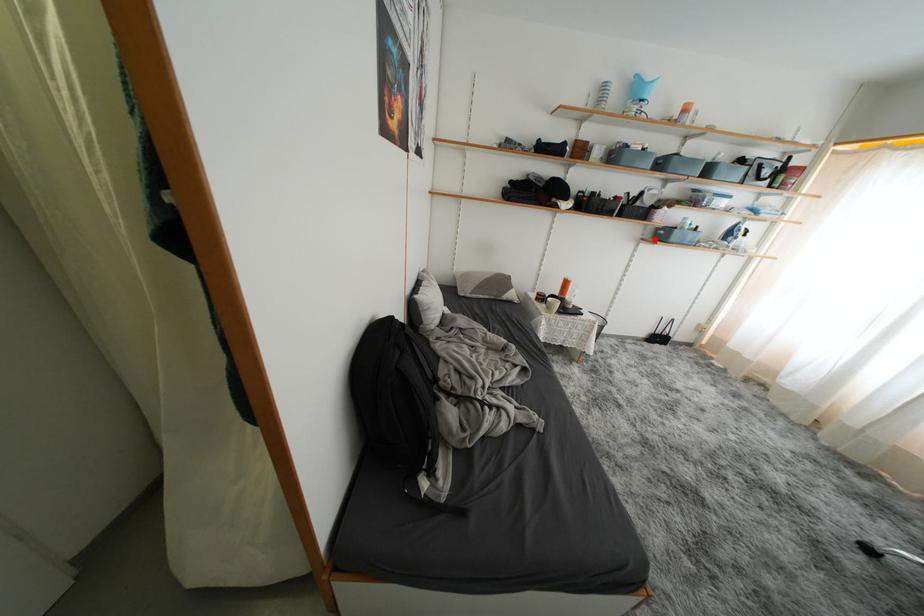
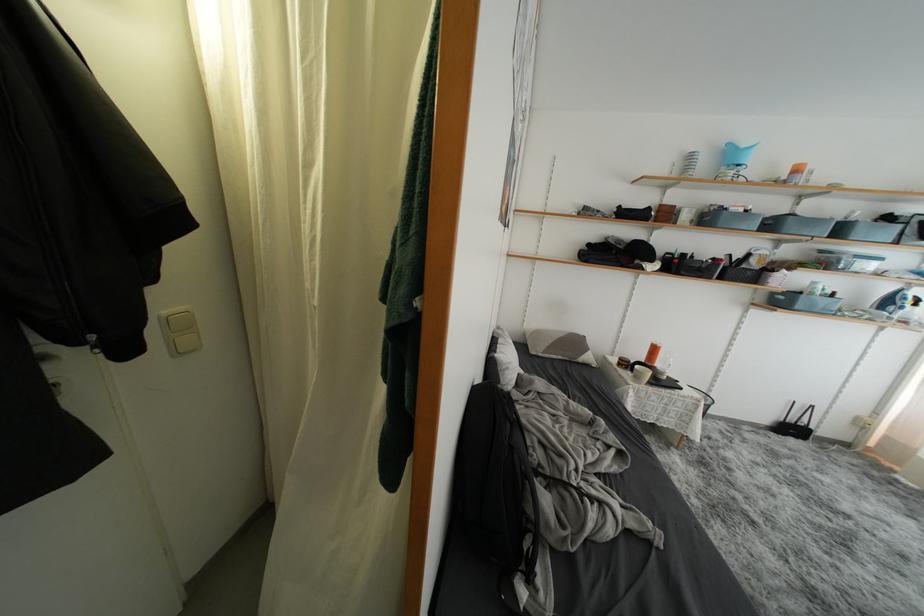
Where in the second image is the point corresponding to the highlighted location from the first image?

(767, 304)